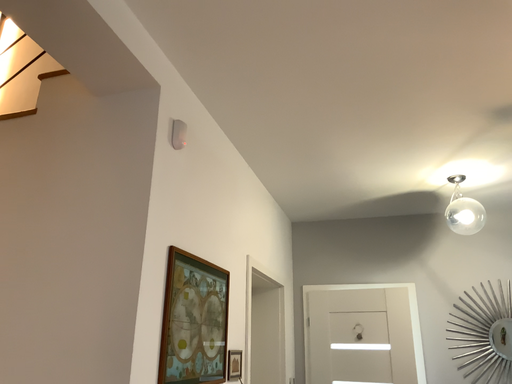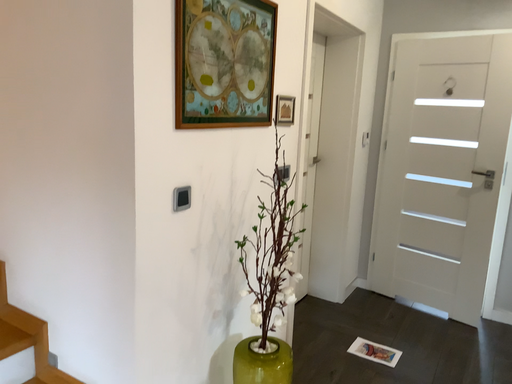
Question: Which way did the camera rotate in the video?

Choices:
 (A) rotated right
 (B) rotated left

Answer: (B)